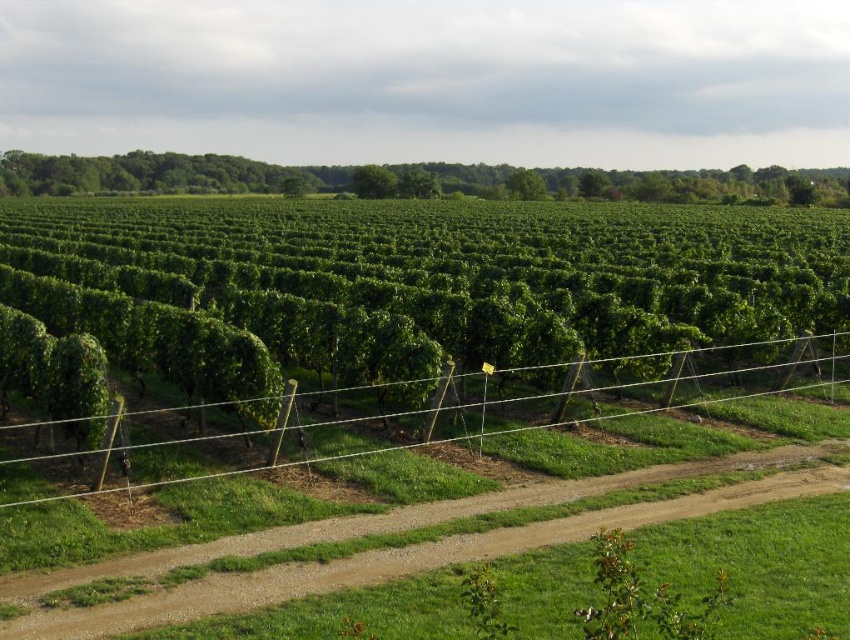
The height and width of the screenshot is (640, 850). Identify the location of brown gravel path at center. (400, 561).

Who is more distant from viewer, (527, 488) or (89, 456)?

Positioned behind is point (89, 456).

Is point (667, 499) positioned in front of point (582, 381)?

Yes, point (667, 499) is closer to viewer.

The image size is (850, 640). I want to click on brown gravel path at center, so click(400, 561).

Is point (620, 273) in front of point (363, 192)?

Yes, point (620, 273) is closer to viewer.

Does green leafy hedge at center have a greater height compared to green leafy tree at center?

Indeed, green leafy hedge at center has a greater height compared to green leafy tree at center.

In the scene shown: Who is more forward, (505,321) or (366,186)?

Point (505,321) is in front.

At what (x,y) coordinates should I click in order to perform the action: click on green leafy hedge at center. Please return your answer as a coordinate pair (x, y). The image size is (850, 640). Looking at the image, I should click on (418, 284).

What do you see at coordinates (156, 173) in the screenshot? The width and height of the screenshot is (850, 640). I see `green leafy tree at upper center` at bounding box center [156, 173].

Measure the distance from green leafy tree at upper center to green leafy tree at center.

green leafy tree at upper center is 95.24 feet away from green leafy tree at center.

Measure the distance between green leafy tree at upper center and camera.

green leafy tree at upper center is 135.84 meters away from camera.

Find the location of a particular element. The width and height of the screenshot is (850, 640). green leafy tree at upper center is located at coordinates (156, 173).